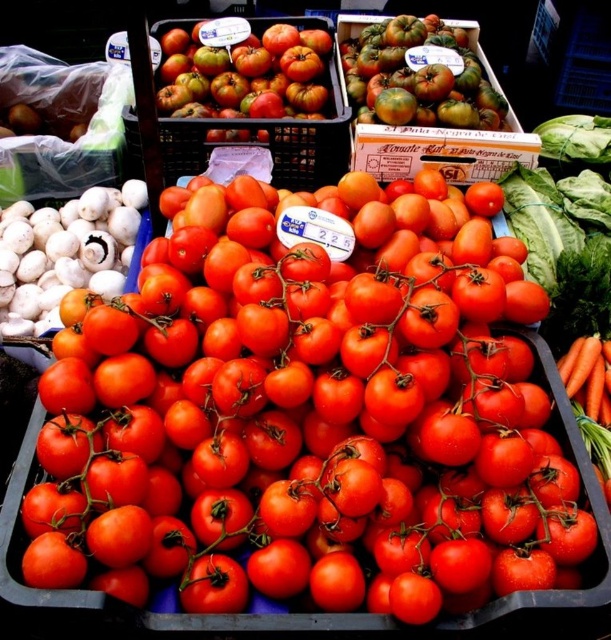
Between shiny red tomatoes at center and rustic matte tomatoes at upper center, which one appears on the right side from the viewer's perspective?

From the viewer's perspective, shiny red tomatoes at center appears more on the right side.

Who is taller, shiny red tomatoes at center or rustic matte tomatoes at upper center?

shiny red tomatoes at center is taller.

The height and width of the screenshot is (640, 611). What do you see at coordinates (306, 417) in the screenshot? I see `shiny red tomatoes at center` at bounding box center [306, 417].

Where is `shiny red tomatoes at center`? shiny red tomatoes at center is located at coordinates coord(306,417).

Does point (126, 541) come behind point (48, 280)?

No, (126, 541) is in front of (48, 280).

Measure the distance between shiny red tomatoes at center and white matte garlic at left.

The distance of shiny red tomatoes at center from white matte garlic at left is 20.71 inches.

I want to click on shiny red tomatoes at center, so click(x=306, y=417).

Between white matte garlic at left and rustic matte tomatoes at upper center, which one has more height?

Standing taller between the two is rustic matte tomatoes at upper center.

Does point (51, 211) lie in front of point (260, 36)?

Yes.

The height and width of the screenshot is (640, 611). Describe the element at coordinates (64, 253) in the screenshot. I see `white matte garlic at left` at that location.

Identify the location of white matte garlic at left. The width and height of the screenshot is (611, 640). pos(64,253).